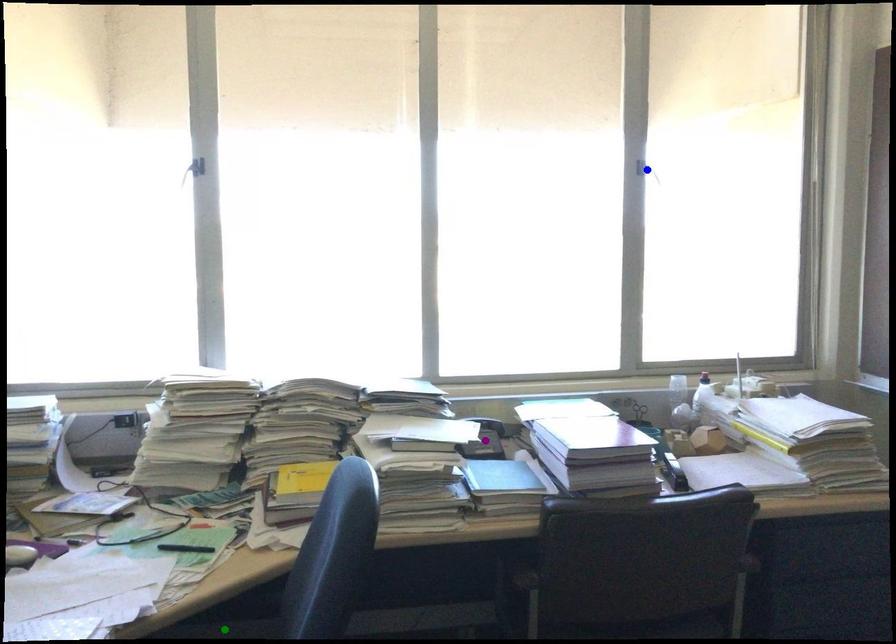
From the picture: Order these from nearest to farthest:
purple point | blue point | green point

purple point < green point < blue point